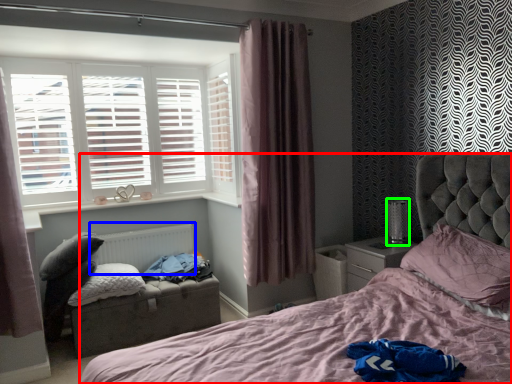
Question: Based on their relative distances, which object is nearer to bed (highlighted by a red box)? Choose from radiator (highlighted by a blue box) and table lamp (highlighted by a green box).

Choices:
 (A) radiator
 (B) table lamp

Answer: (B)